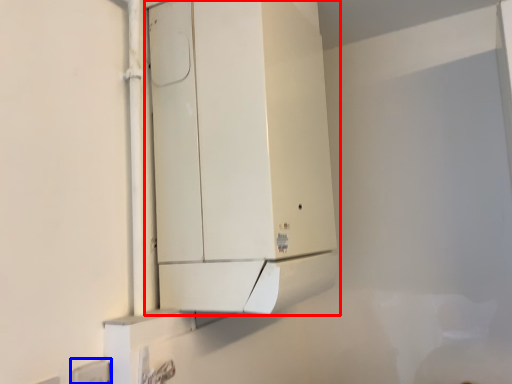
Question: Which object is further to the camera taking this photo, cabinetry (highlighted by a red box) or electric outlet (highlighted by a blue box)?

Choices:
 (A) cabinetry
 (B) electric outlet

Answer: (A)